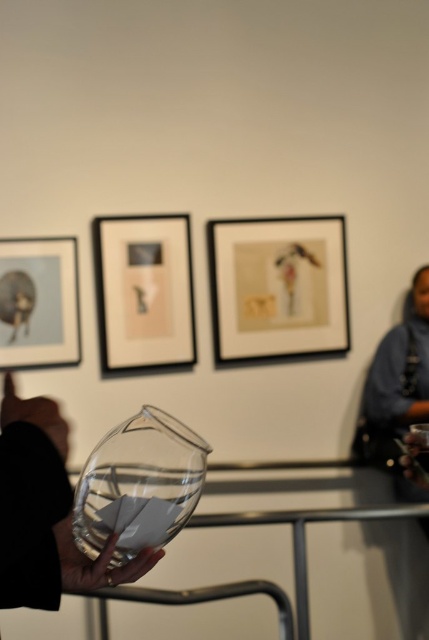
You are an art curator arranging a new exhibition. You have two frames to place on a wall that has limited space. The matte black picture frame at upper center and the matte glass picture frame at upper left need to be positioned such that the smaller frame is closer to the entrance. Which frame should be placed closer to the entrance?

The matte glass picture frame at upper left is smaller than the matte black picture frame at upper center, so the matte glass picture frame at upper left should be placed closer to the entrance.

You are an art curator planning to hang a new painting in the gallery. You want to place it near the point at coordinates point (144,292). What object is located at that point?

The point (144,292) is on the matte black picture frame at upper center.

You are an art curator standing in front of the wall with three framed artworks. You need to adjust the lighting so that the spotlight reaches both the matte paper picture frame at center and the matte glass picture frame at upper left. Considering their positions, which frame will require the light to be angled downward more?

The matte paper picture frame at center is further to the viewer than the matte glass picture frame at upper left, so the light should be angled downward more to reach the matte glass picture frame at upper left.